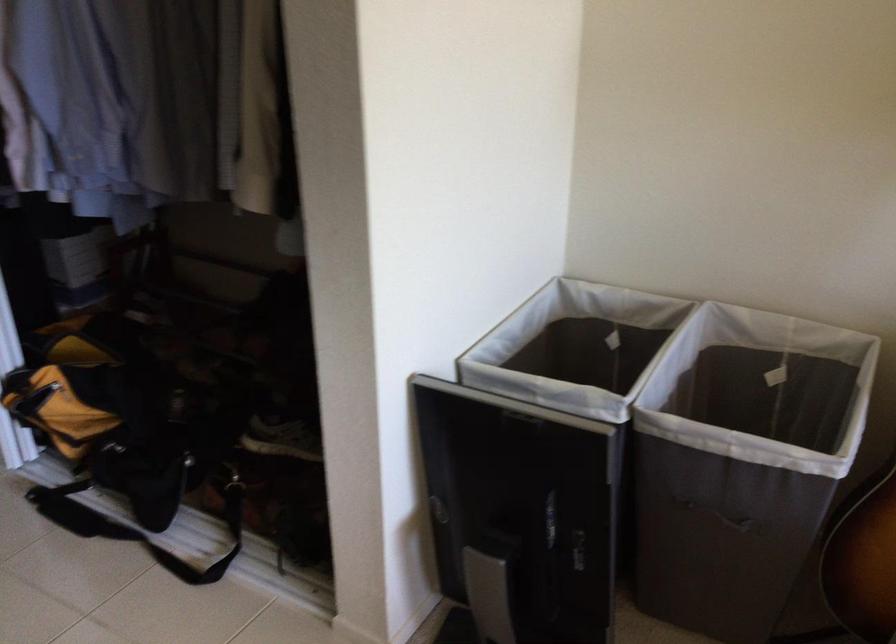
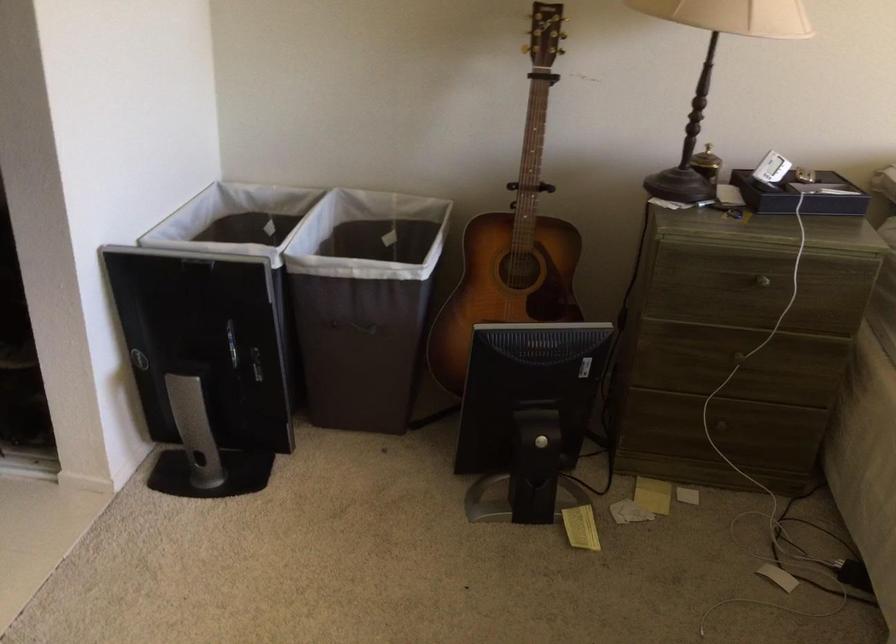
The point at (506,538) is marked in the first image. Where is the corresponding point in the second image?

(203, 365)